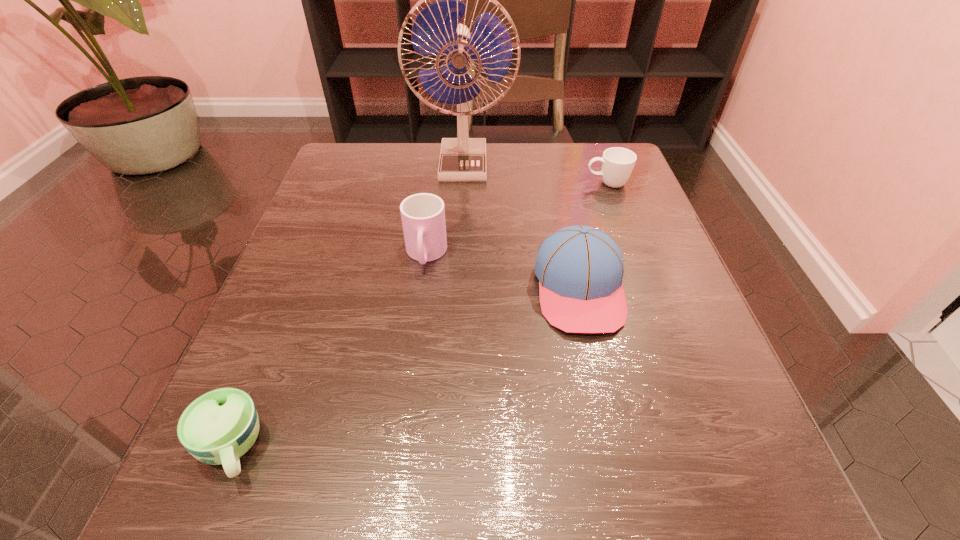
Where is `vacant space in between the tallest object and the baseball cap`? This screenshot has height=540, width=960. vacant space in between the tallest object and the baseball cap is located at coordinates (521, 227).

The width and height of the screenshot is (960, 540). In order to click on free space between the baseball cap and the nearest object in this screenshot , I will do `click(405, 368)`.

The width and height of the screenshot is (960, 540). Identify the location of vacant area that lies between the baseball cap and the second nearest cup. (503, 272).

Find the location of `empty space between the tallest object and the baseball cap`. empty space between the tallest object and the baseball cap is located at coordinates (521, 227).

This screenshot has width=960, height=540. Find the location of `vacant region between the nearest cup and the rightmost cup`. vacant region between the nearest cup and the rightmost cup is located at coordinates (420, 316).

The image size is (960, 540). In order to click on object that stands as the closest to the baseball cap in this screenshot , I will do 423,215.

Locate which object ranks second in proximity to the tallest object. Please provide its 2D coordinates. Your answer should be formatted as a tuple, i.e. [(x, y)], where the tuple contains the x and y coordinates of a point satisfying the conditions above.

[(423, 215)]

Point out which cup is positioned as the nearest to the farthest cup. Please provide its 2D coordinates. Your answer should be formatted as a tuple, i.e. [(x, y)], where the tuple contains the x and y coordinates of a point satisfying the conditions above.

[(423, 215)]

Select which cup is the closest to the second nearest cup. Please provide its 2D coordinates. Your answer should be formatted as a tuple, i.e. [(x, y)], where the tuple contains the x and y coordinates of a point satisfying the conditions above.

[(220, 426)]

What are the coordinates of `free space that satisfies the following two spatial constraints: 1. with the handle on the side of the rightmost cup; 2. on the front-facing side of the baseball cap` in the screenshot? It's located at (645, 289).